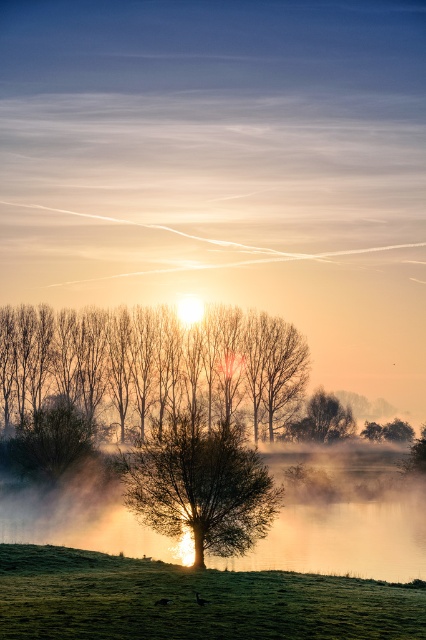
Question: Is translucent misty water at center to the right of smooth brown tree at left from the viewer's perspective?

Choices:
 (A) no
 (B) yes

Answer: (B)

Question: Which point appears closest to the camera in this image?

Choices:
 (A) (45, 416)
 (B) (236, 516)

Answer: (B)

Question: Is translucent misty water at center smaller than smooth brown tree at left?

Choices:
 (A) no
 (B) yes

Answer: (A)

Question: Based on their relative distances, which object is nearer to the green leafy tree at center?

Choices:
 (A) green grassy field at lower center
 (B) smooth brown tree at upper right
 (C) translucent misty water at center

Answer: (C)

Question: From the image, what is the correct spatial relationship of translucent misty water at center in relation to green leafy tree at center?

Choices:
 (A) above
 (B) below

Answer: (B)

Question: Which point is farther to the camera?

Choices:
 (A) green leafy tree at center
 (B) translucent misty water at center

Answer: (A)